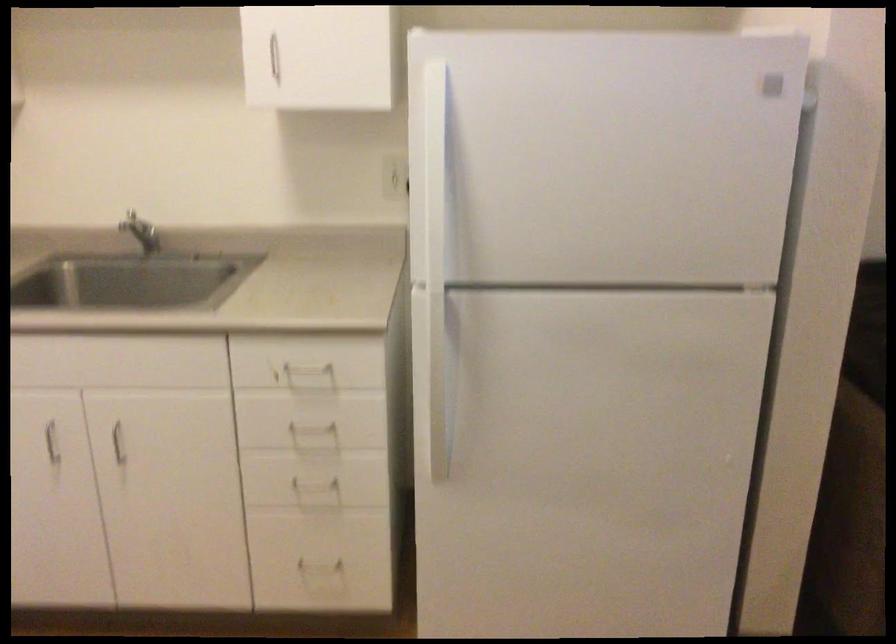
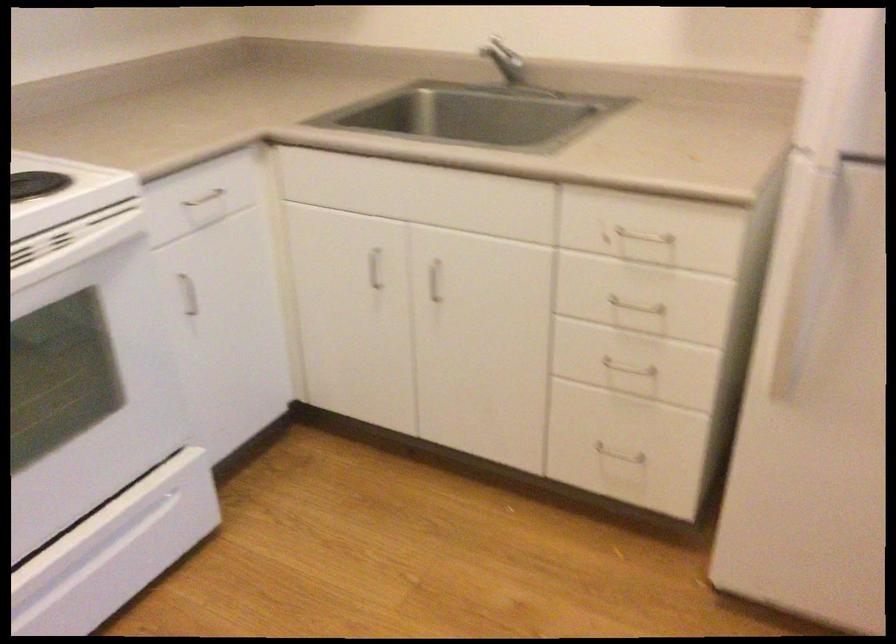
Find the pixel in the second image that matches the point at 325,572 in the first image.

(619, 464)